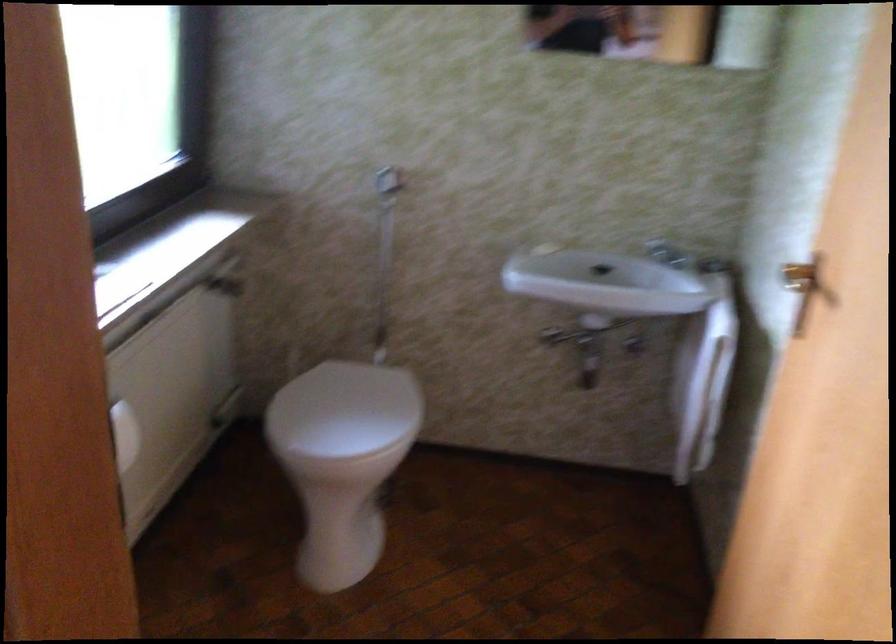
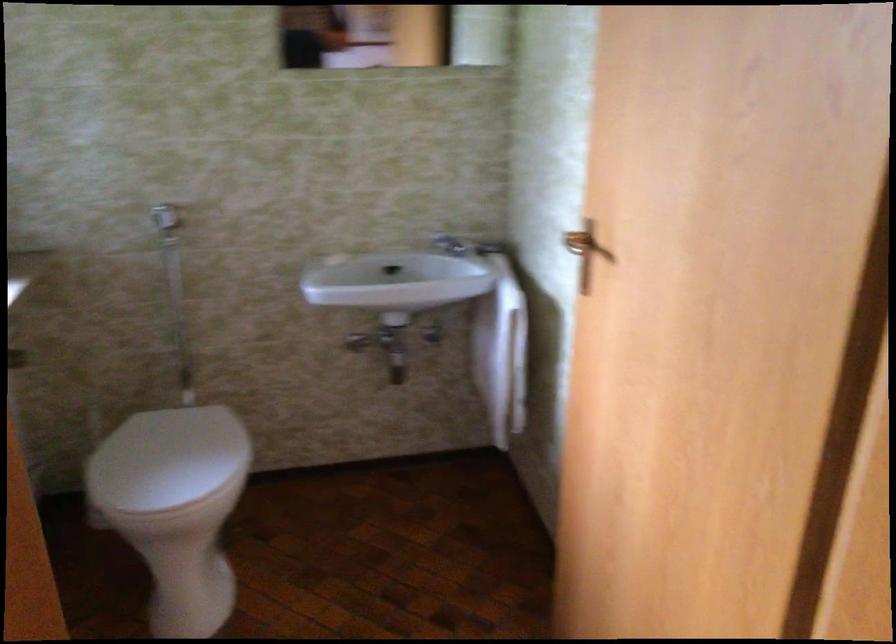
Where in the second image is the point corresponding to [803,267] from the first image?

(578, 242)